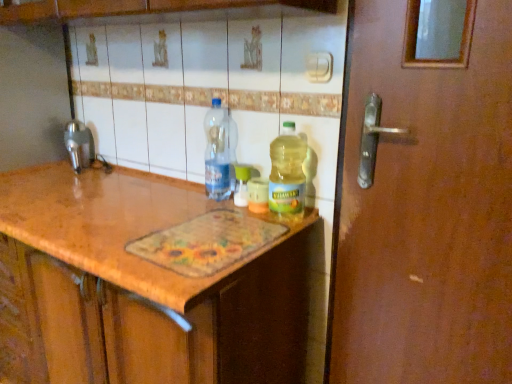
Question: From the image's perspective, does brushed metal faucet at left appear higher than transparent plastic bottle at center, the 1th bottle when ordered from left to right?

Choices:
 (A) yes
 (B) no

Answer: (A)

Question: From a real-world perspective, is brushed metal faucet at left positioned under transparent plastic bottle at center, which appears as the 3th bottle when viewed from the right, based on gravity?

Choices:
 (A) no
 (B) yes

Answer: (B)

Question: Is brushed metal faucet at left outside of transparent plastic bottle at center, the 1th bottle when ordered from left to right?

Choices:
 (A) yes
 (B) no

Answer: (A)

Question: Is brushed metal faucet at left aimed at transparent plastic bottle at center, the 1th bottle when ordered from left to right?

Choices:
 (A) no
 (B) yes

Answer: (A)

Question: Is transparent plastic bottle at center, which appears as the 3th bottle when viewed from the right, inside brushed metal faucet at left?

Choices:
 (A) yes
 (B) no

Answer: (B)

Question: From the image's perspective, is brushed metal faucet at left located beneath transparent plastic bottle at center, which appears as the 3th bottle when viewed from the right?

Choices:
 (A) yes
 (B) no

Answer: (B)

Question: From the image's perspective, is transparent plastic bottle at center, which appears as the 3th bottle when viewed from the right, beneath translucent plastic bottle at center, the first bottle viewed from the right?

Choices:
 (A) no
 (B) yes

Answer: (A)

Question: Considering the relative sizes of transparent plastic bottle at center, the 1th bottle when ordered from left to right, and translucent plastic bottle at center, which is the third bottle from left to right, in the image provided, is transparent plastic bottle at center, the 1th bottle when ordered from left to right, thinner than translucent plastic bottle at center, which is the third bottle from left to right,?

Choices:
 (A) no
 (B) yes

Answer: (A)

Question: Is transparent plastic bottle at center, the 1th bottle when ordered from left to right, wider than translucent plastic bottle at center, the first bottle viewed from the right?

Choices:
 (A) yes
 (B) no

Answer: (A)

Question: Is transparent plastic bottle at center, the 1th bottle when ordered from left to right, in front of translucent plastic bottle at center, which is the third bottle from left to right?

Choices:
 (A) no
 (B) yes

Answer: (A)

Question: Could you tell me if transparent plastic bottle at center, the 1th bottle when ordered from left to right, is turned towards translucent plastic bottle at center, which is the third bottle from left to right?

Choices:
 (A) yes
 (B) no

Answer: (B)

Question: Is transparent plastic bottle at center, which appears as the 3th bottle when viewed from the right, to the left of translucent plastic bottle at center, the first bottle viewed from the right, from the viewer's perspective?

Choices:
 (A) no
 (B) yes

Answer: (B)

Question: Considering the relative sizes of brushed metal faucet at left and translucent plastic bottle at center, positioned as the 2th bottle in right-to-left order, in the image provided, is brushed metal faucet at left shorter than translucent plastic bottle at center, positioned as the 2th bottle in right-to-left order,?

Choices:
 (A) yes
 (B) no

Answer: (B)